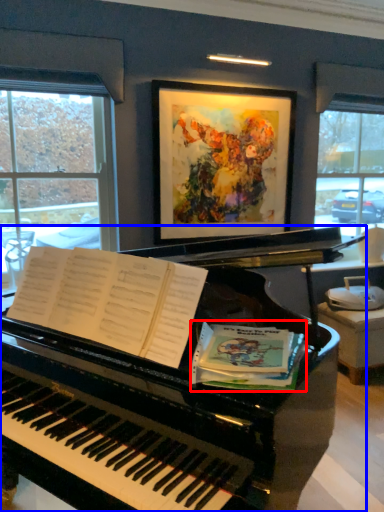
Question: Among these objects, which one is nearest to the camera, paperback book (highlighted by a red box) or piano (highlighted by a blue box)?

Choices:
 (A) paperback book
 (B) piano

Answer: (B)